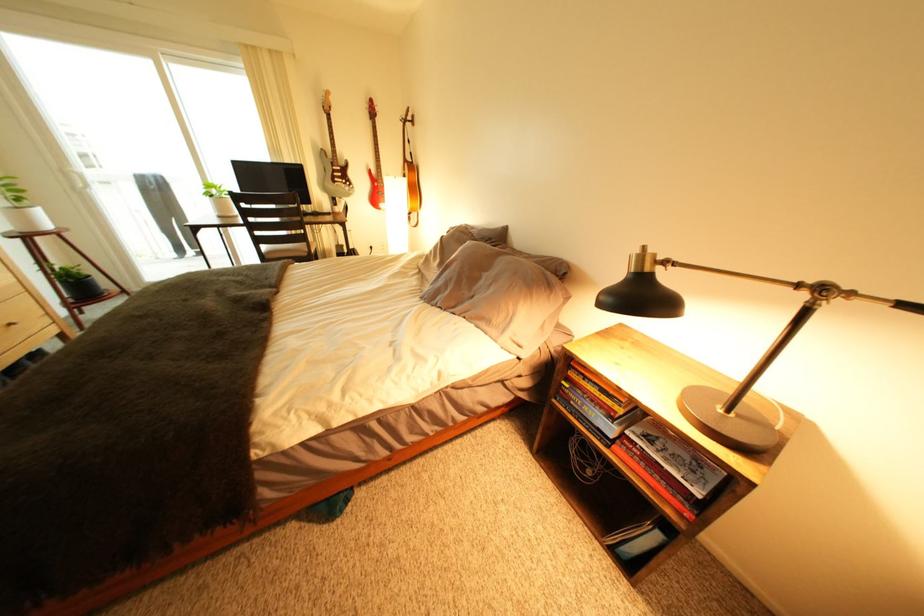
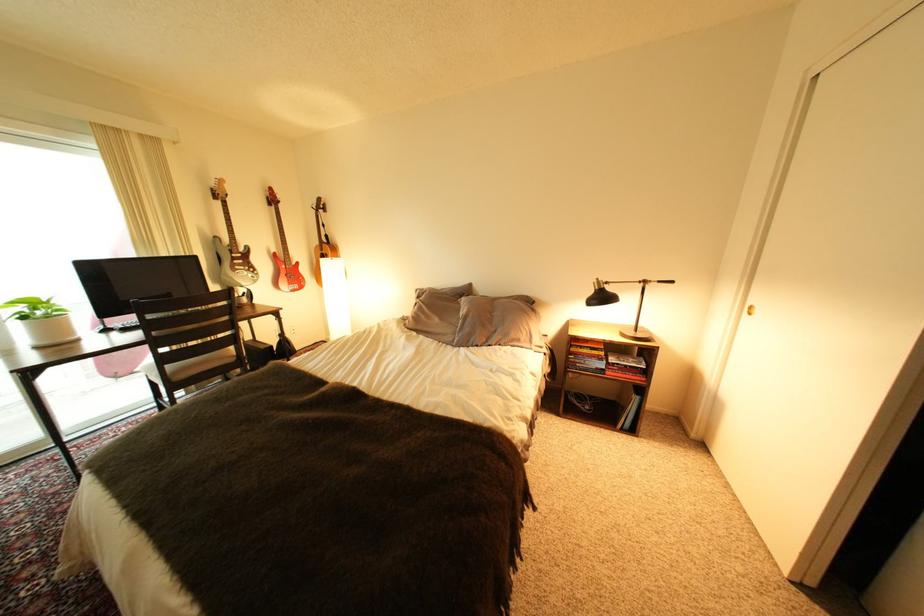
In the second image, find the point that corresponds to point (345, 167) in the first image.

(244, 254)